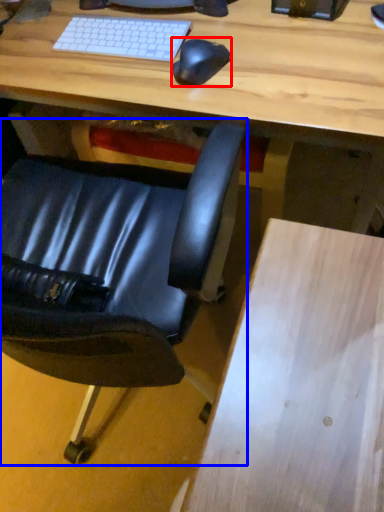
Question: Which object appears farthest to the camera in this image, mouse (highlighted by a red box) or chair (highlighted by a blue box)?

Choices:
 (A) mouse
 (B) chair

Answer: (A)